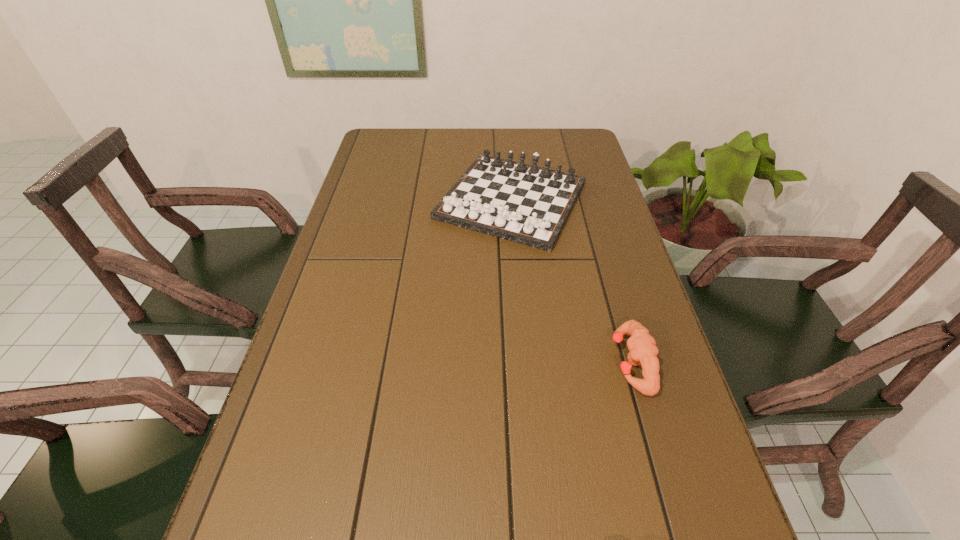
Image resolution: width=960 pixels, height=540 pixels. In order to click on chessboard in this screenshot , I will do `click(526, 204)`.

This screenshot has height=540, width=960. What are the coordinates of `the taller object` in the screenshot? It's located at (526, 204).

This screenshot has height=540, width=960. Find the location of `the nearer object`. the nearer object is located at coordinates (643, 352).

Locate an element on the screen. The height and width of the screenshot is (540, 960). the shorter object is located at coordinates (643, 352).

Where is `free space located on the front of the farther object`? The height and width of the screenshot is (540, 960). free space located on the front of the farther object is located at coordinates (520, 308).

The image size is (960, 540). In order to click on free location located with the gloves of the nearer object facing forward in this screenshot , I will do `click(589, 362)`.

Where is `vacant space located 0.260m with the gloves of the nearer object facing forward`? vacant space located 0.260m with the gloves of the nearer object facing forward is located at coordinates (492, 362).

Identify the location of vacant region located with the gloves of the nearer object facing forward. (557, 362).

Where is `object situated at the far edge`? Image resolution: width=960 pixels, height=540 pixels. object situated at the far edge is located at coordinates (526, 204).

Image resolution: width=960 pixels, height=540 pixels. I want to click on chessboard located in the right edge section of the desktop, so click(526, 204).